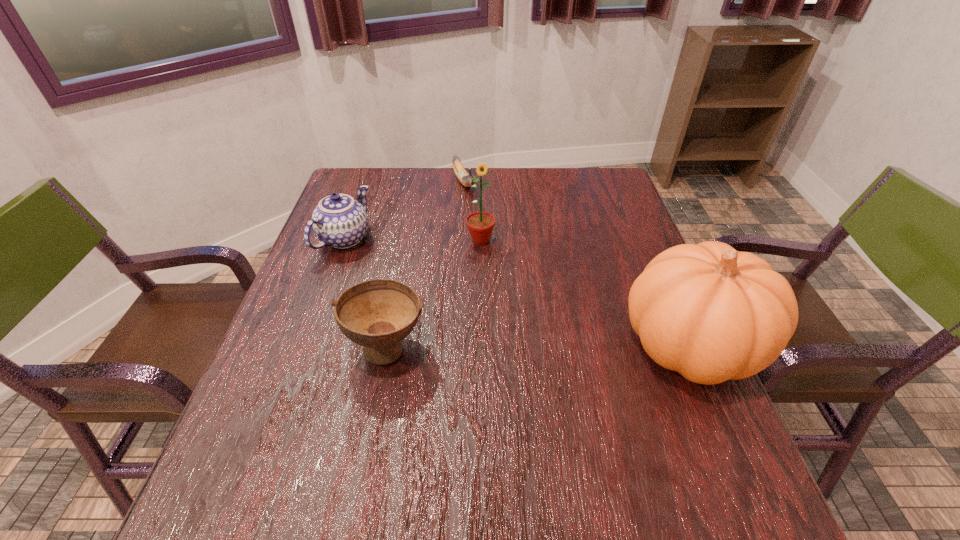
Where is `vacant space located 0.130m on the face of the sunflower`? vacant space located 0.130m on the face of the sunflower is located at coordinates (496, 281).

Where is `blank area located at the spout of the chinaware`? blank area located at the spout of the chinaware is located at coordinates (476, 305).

Where is `vacant point located at the spout of the chinaware`? Image resolution: width=960 pixels, height=540 pixels. vacant point located at the spout of the chinaware is located at coordinates (491, 311).

This screenshot has height=540, width=960. Find the location of `free space located at the spout of the chinaware`. free space located at the spout of the chinaware is located at coordinates (425, 281).

This screenshot has width=960, height=540. In order to click on vacant space located 0.220m on the peel of the farthest object in this screenshot , I will do `click(492, 237)`.

You are a GUI agent. You are given a task and a screenshot of the screen. Output one action in this format:
    pyautogui.click(x=<x>, y=<y>)
    Task: Click on the vacant point located 0.260m on the peel of the farthest object
    The image size is (960, 540).
    Given the screenshot: What is the action you would take?
    pyautogui.click(x=498, y=245)

This screenshot has width=960, height=540. In order to click on vacant space situated 0.140m on the peel of the farthest object in this screenshot , I will do `click(483, 221)`.

This screenshot has width=960, height=540. Identify the location of object present at the far edge. (465, 179).

Where is `soup bowl that is positioned at the left edge`? The height and width of the screenshot is (540, 960). soup bowl that is positioned at the left edge is located at coordinates (377, 314).

Find the location of a particular element. chinaware situated at the left edge is located at coordinates (339, 221).